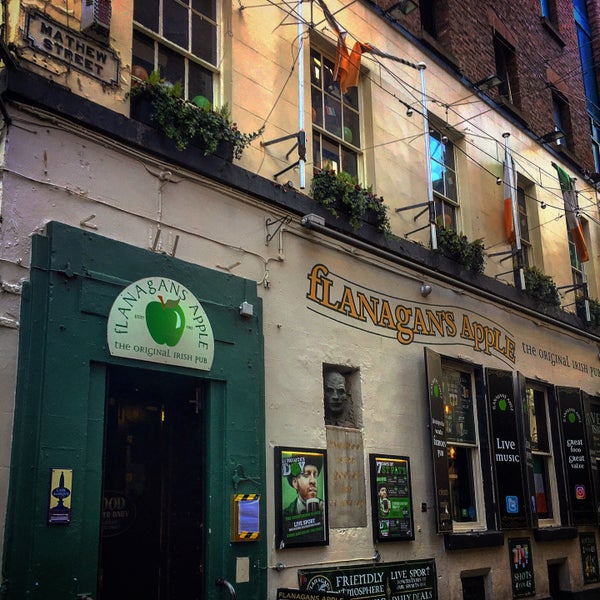
Where is `light fixture`? The width and height of the screenshot is (600, 600). light fixture is located at coordinates (432, 290).